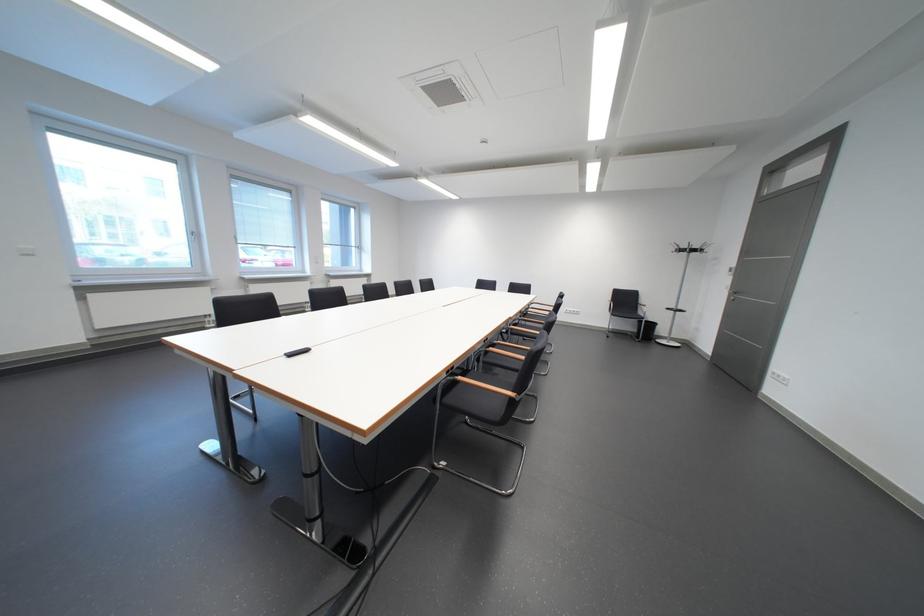
In order to click on silver door handle in this screenshot , I will do `click(735, 297)`.